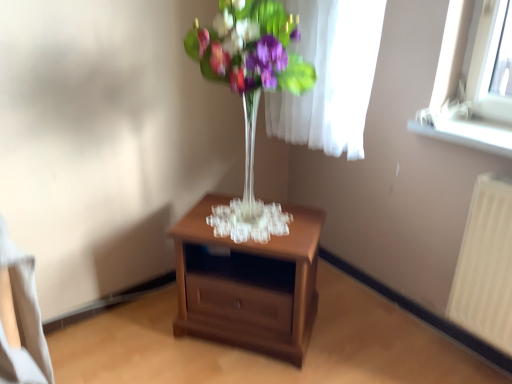
The width and height of the screenshot is (512, 384). Identify the location of free region on the left part of brown wooden nightstand at center. (145, 337).